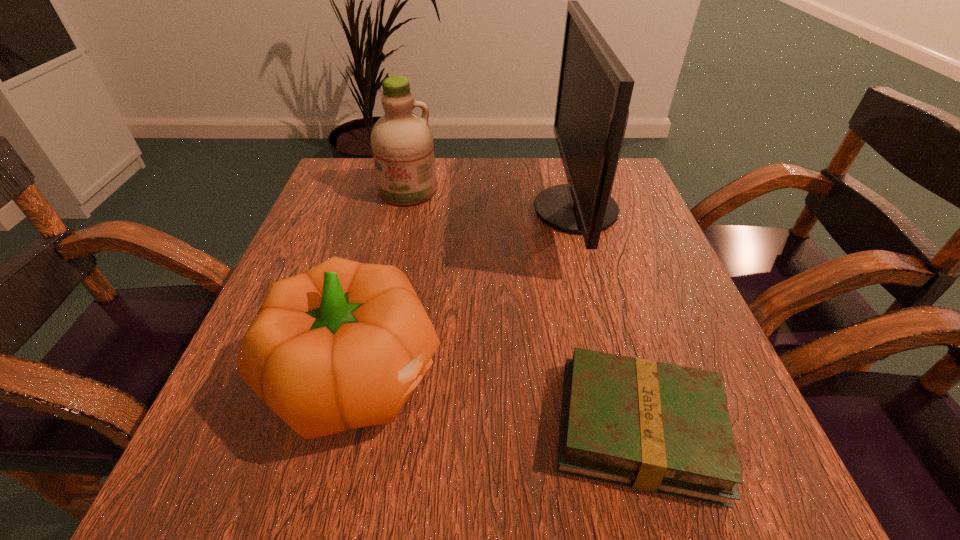
In order to click on unoccupied position between the tallest object and the cleansing agent in this screenshot , I will do `click(492, 201)`.

Find the location of a particular element. free space between the monitor and the shortest object is located at coordinates (607, 319).

Find the location of a particular element. Image resolution: width=960 pixels, height=540 pixels. free point between the shortest object and the pumpkin is located at coordinates (498, 402).

The height and width of the screenshot is (540, 960). What are the coordinates of `vacant region between the book and the pumpkin` in the screenshot? It's located at (498, 402).

The width and height of the screenshot is (960, 540). In order to click on object that is the third closest to the second tallest object in this screenshot , I will do `click(657, 427)`.

At what (x,y) coordinates should I click in order to perform the action: click on the third closest object relative to the second tallest object. Please return your answer as a coordinate pair (x, y). Looking at the image, I should click on (657, 427).

Where is `free region that satisfies the following two spatial constraints: 1. on the back side of the book; 2. on the screen side of the monitor`? This screenshot has height=540, width=960. free region that satisfies the following two spatial constraints: 1. on the back side of the book; 2. on the screen side of the monitor is located at coordinates (577, 210).

Where is `vacant space that satisfies the following two spatial constraints: 1. on the back side of the shortest object; 2. on the carved face of the pumpkin`? vacant space that satisfies the following two spatial constraints: 1. on the back side of the shortest object; 2. on the carved face of the pumpkin is located at coordinates (624, 376).

Where is `free space that satisfies the following two spatial constraints: 1. on the front label of the cleansing agent; 2. on the carved face of the third tallest object`? The height and width of the screenshot is (540, 960). free space that satisfies the following two spatial constraints: 1. on the front label of the cleansing agent; 2. on the carved face of the third tallest object is located at coordinates (368, 376).

This screenshot has width=960, height=540. Identify the location of free space that satisfies the following two spatial constraints: 1. on the front label of the second tallest object; 2. on the carved face of the pumpkin. (368, 376).